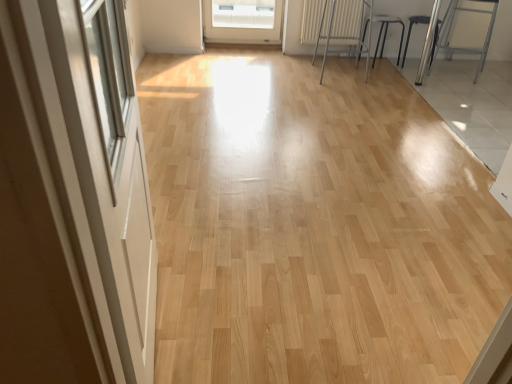
Locate an element on the screen. Image resolution: width=512 pixels, height=384 pixels. vacant area that lies between white glossy screen door at left and metallic silver radiator at upper center is located at coordinates (260, 195).